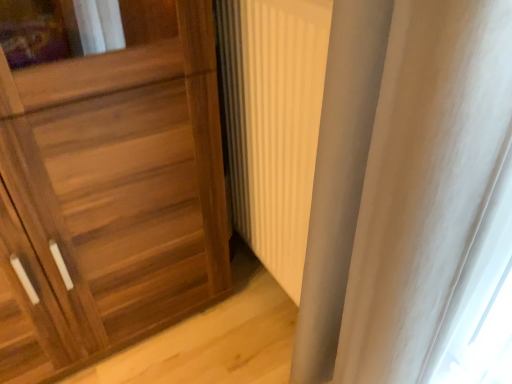
Find the location of `white ribbed radiator at center`. white ribbed radiator at center is located at coordinates (274, 123).

What do you see at coordinates (274, 123) in the screenshot? I see `white ribbed radiator at center` at bounding box center [274, 123].

Where is `white ribbed radiator at center`? This screenshot has width=512, height=384. white ribbed radiator at center is located at coordinates pos(274,123).